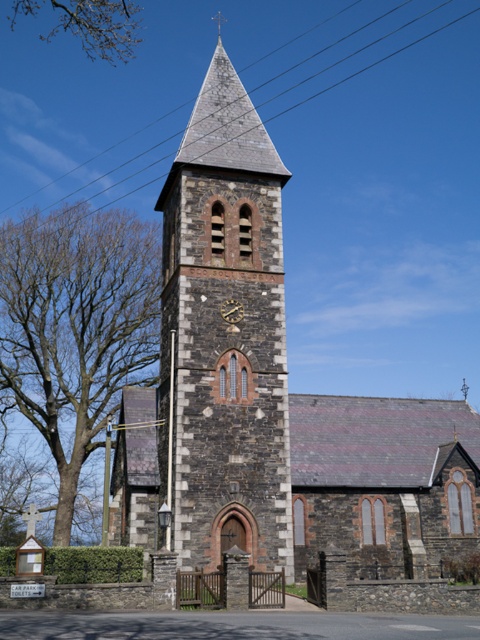
Is brown leafless tree at left closer to camera compared to bare branches at upper left?

Yes, it is.

Can you confirm if brown leafless tree at left is smaller than bare branches at upper left?

Yes.

Between point (130, 380) and point (86, 22), which one is positioned behind?

The point (130, 380) is more distant.

You are a GUI agent. You are given a task and a screenshot of the screen. Output one action in this format:
    pyautogui.click(x=<x>, y=<y>)
    Task: Click on the brown leafless tree at left
    This screenshot has height=640, width=480.
    Given the screenshot: What is the action you would take?
    pyautogui.click(x=74, y=326)

Is point (439, 284) more distant than point (23, 8)?

That is False.

The image size is (480, 640). What do you see at coordinates (384, 193) in the screenshot?
I see `metallic wire at upper center` at bounding box center [384, 193].

Which is behind, point (383, 88) or point (109, 6)?

The point (383, 88) is more distant.

This screenshot has height=640, width=480. What are the coordinates of `metallic wire at upper center` in the screenshot? It's located at (384, 193).

Looking at this image, is dark gray stone church at center smaller than gold textured clock at center?

No.

Does point (183, 220) come behind point (240, 317)?

That is True.

Identify the location of dark gray stone church at center. The image size is (480, 640). (269, 397).